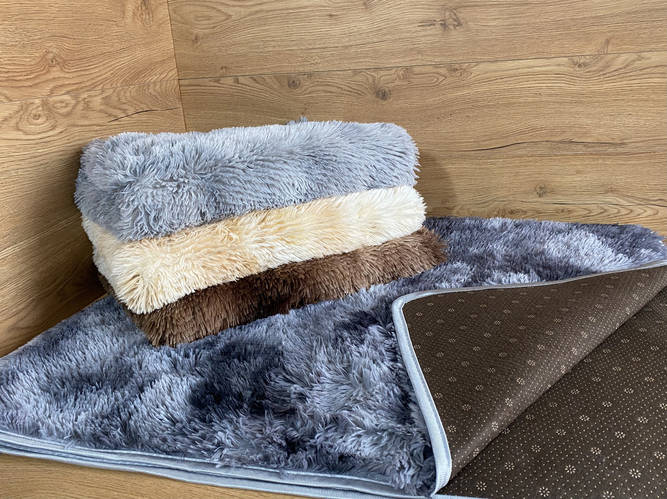
Where is `mat`? This screenshot has height=499, width=667. mat is located at coordinates (388, 417).